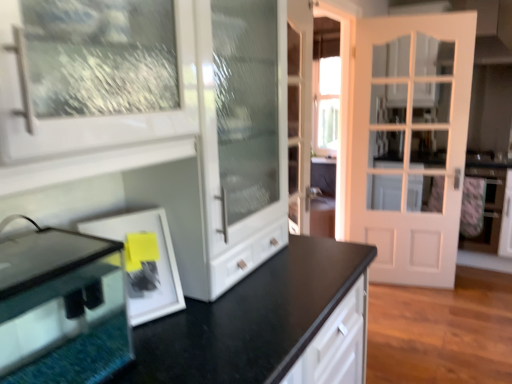
Question: Can you confirm if clear glass fish tank at lower left is positioned to the right of white matte picture frame at lower left?

Choices:
 (A) yes
 (B) no

Answer: (B)

Question: Does clear glass fish tank at lower left turn towards white matte picture frame at lower left?

Choices:
 (A) yes
 (B) no

Answer: (B)

Question: Is clear glass fish tank at lower left far away from white matte picture frame at lower left?

Choices:
 (A) no
 (B) yes

Answer: (A)

Question: Does clear glass fish tank at lower left have a greater width compared to white matte picture frame at lower left?

Choices:
 (A) yes
 (B) no

Answer: (A)

Question: From the image's perspective, is clear glass fish tank at lower left under white matte picture frame at lower left?

Choices:
 (A) no
 (B) yes

Answer: (B)

Question: Is the position of clear glass fish tank at lower left more distant than that of white matte picture frame at lower left?

Choices:
 (A) no
 (B) yes

Answer: (A)

Question: Is white matte door at right closer to the viewer compared to clear glass fish tank at lower left?

Choices:
 (A) yes
 (B) no

Answer: (B)

Question: Is white matte door at right placed right next to clear glass fish tank at lower left?

Choices:
 (A) no
 (B) yes

Answer: (A)

Question: Is white matte door at right completely or partially outside of clear glass fish tank at lower left?

Choices:
 (A) yes
 (B) no

Answer: (A)

Question: Is white matte door at right at the left side of clear glass fish tank at lower left?

Choices:
 (A) no
 (B) yes

Answer: (A)

Question: Considering the relative sizes of white matte door at right and clear glass fish tank at lower left in the image provided, is white matte door at right bigger than clear glass fish tank at lower left?

Choices:
 (A) yes
 (B) no

Answer: (A)

Question: Can you confirm if white matte door at right is wider than clear glass fish tank at lower left?

Choices:
 (A) yes
 (B) no

Answer: (B)

Question: Is white matte picture frame at lower left facing away from clear glass fish tank at lower left?

Choices:
 (A) no
 (B) yes

Answer: (A)